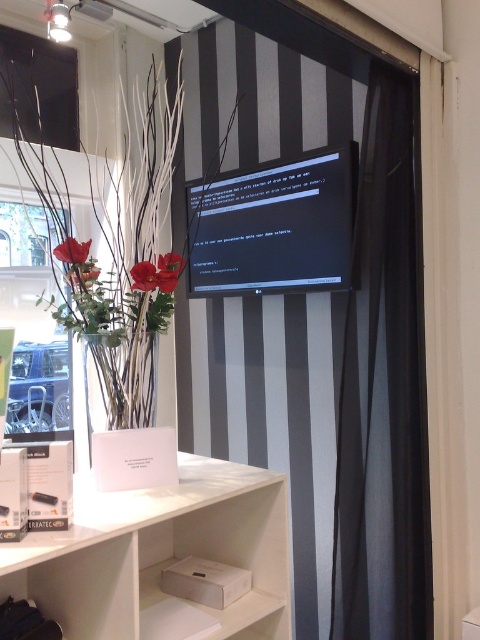
You are a painter standing 1.5 meters away from the black matte curtain at upper center. Can you reach the curtain to paint it without moving your position?

The distance between you and the black matte curtain at upper center is 1.42 meters, which is less than 1.5 meters. Therefore, you can reach the curtain to paint it without moving your position.

You are standing in the room and want to place a small table between the two points, point (243, 429) and point (166, 268). Can you place it there without it being blocked by the floral arrangement?

Point (243, 429) is behind point (166, 268), so placing a table between them would require it to be behind the floral arrangement at point (166, 268). Therefore, the table might be blocked by the floral arrangement.

You are a painter standing in front of the wall with the black and white stripes. You want to paint a line connecting the black matte curtain at upper center and the red matte flower at center. How long should the line be?

The line should be 3.42 feet long to connect the black matte curtain at upper center and the red matte flower at center.